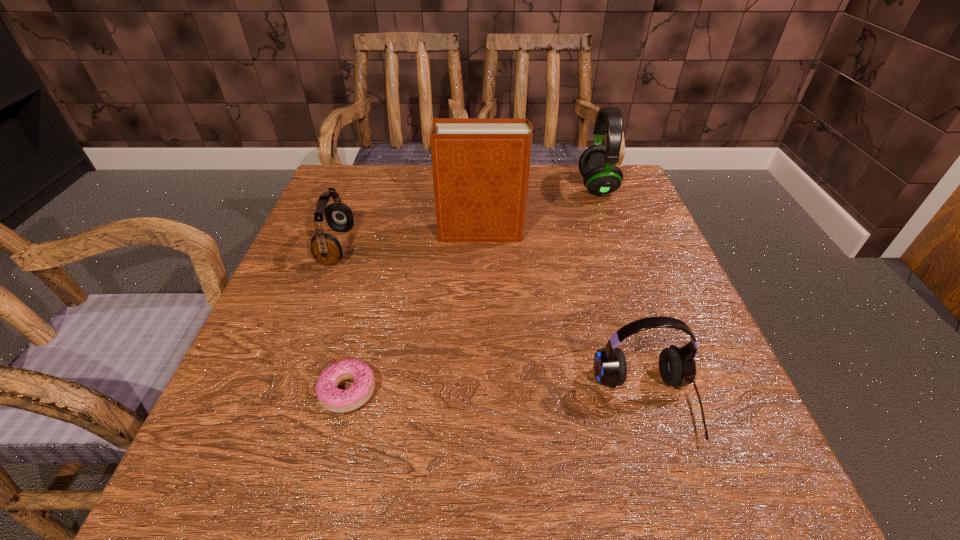
Where is `hardback book`? hardback book is located at coordinates (481, 166).

Where is `the third object from left to right`? This screenshot has height=540, width=960. the third object from left to right is located at coordinates [481, 166].

The image size is (960, 540). I want to click on the fourth shortest object, so click(x=597, y=164).

Identify the location of the tallest headset. (597, 164).

Where is `the nearest headset`? This screenshot has width=960, height=540. the nearest headset is located at coordinates (677, 367).

At what (x,y) coordinates should I click in order to perform the action: click on the leftmost object. Please return your answer as a coordinate pair (x, y). The width and height of the screenshot is (960, 540). Looking at the image, I should click on (325, 248).

Image resolution: width=960 pixels, height=540 pixels. What are the coordinates of `the second nearest headset` in the screenshot? It's located at (325, 248).

Locate an element on the screen. The height and width of the screenshot is (540, 960). the fourth object from right to left is located at coordinates (336, 400).

Identify the location of the shortest object. This screenshot has height=540, width=960. (336, 400).

Where is `vacant space located on the open cover of the tallest object`? The width and height of the screenshot is (960, 540). vacant space located on the open cover of the tallest object is located at coordinates (318, 232).